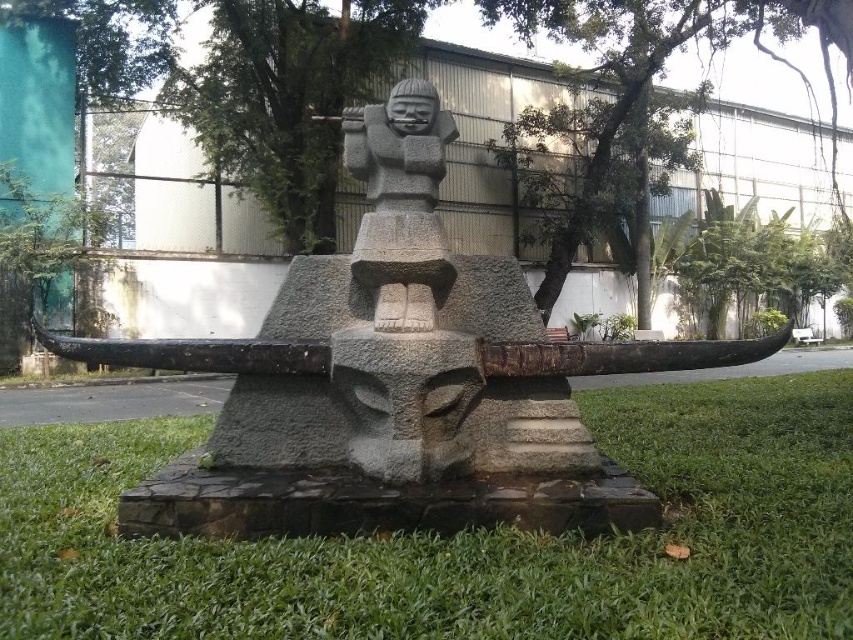
You are a landscape architect designing a garden and want to place a new decorative fountain between the green grass at center and the gray stone statue at center. Based on their widths, which object should the fountain be closer to?

The green grass at center is wider than the gray stone statue at center, so the fountain should be placed closer to the gray stone statue at center to balance the space.

You are standing in front of the sculpture and want to place a small flower pot on the grass. If you walk straight towards the gray stone statue at center, will you step on the green grass at center before reaching the statue?

Yes, because the green grass at center is to the left of gray stone statue at center, so walking straight towards the statue would require stepping on the grass first before reaching the statue.

You are standing in front of the sculpture and want to step onto the green grass at center. Is the gray stone statue at center blocking your path?

The green grass at center is closer to the viewer than the gray stone statue at center, so the gray stone statue at center is behind the green grass at center and not blocking the path.